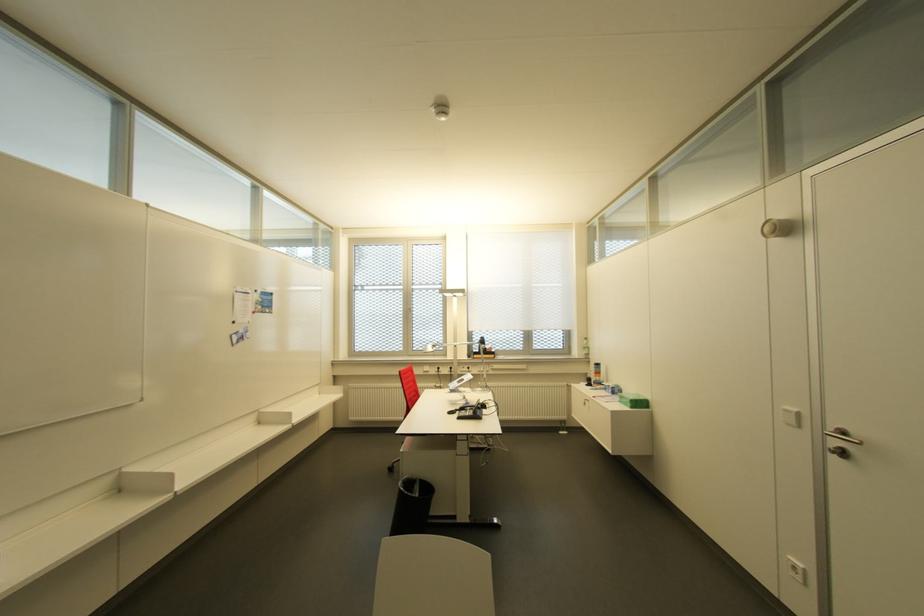
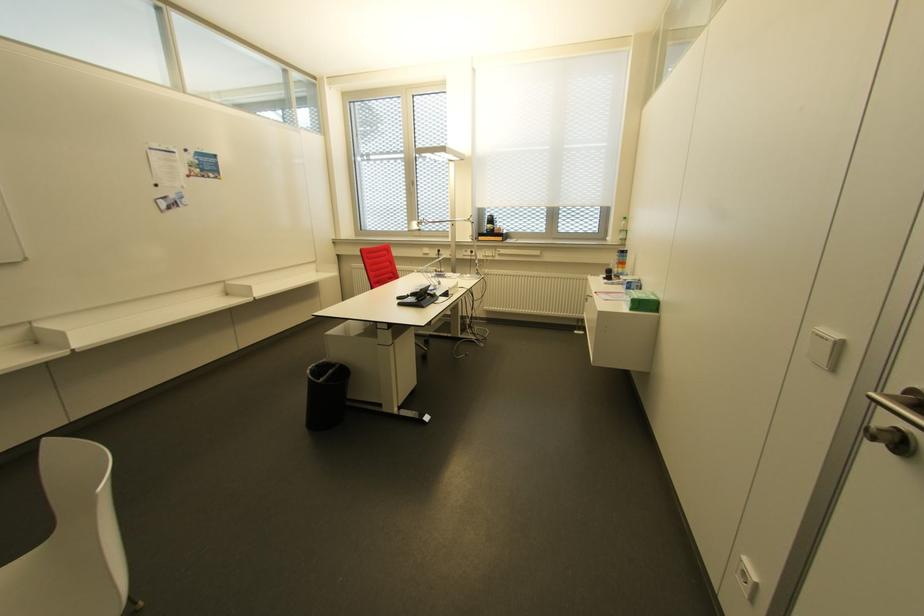
Question: I am providing you with two images of the same scene from different viewpoints. Please identify which objects are invisible in image2.

Choices:
 (A) metal door handle
 (B) black trash can
 (C) white chair sitting surface
 (D) none of these

Answer: (D)